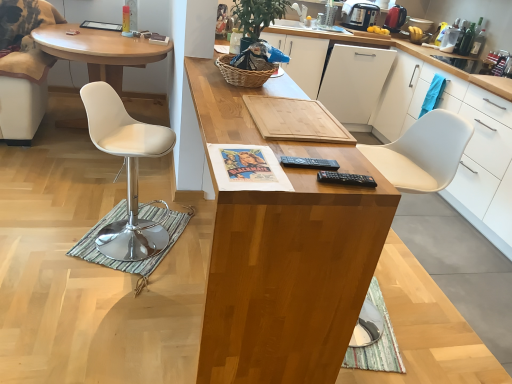
Question: Is white leather desk at left, arranged as the 1th desk when viewed from the back, smaller than white matte drawer at upper right?

Choices:
 (A) no
 (B) yes

Answer: (A)

Question: Does white leather desk at left, the 1th desk viewed from the left, have a greater height compared to white matte drawer at upper right?

Choices:
 (A) no
 (B) yes

Answer: (B)

Question: Is the depth of white leather desk at left, the 1th desk viewed from the left, greater than that of white matte drawer at upper right?

Choices:
 (A) no
 (B) yes

Answer: (A)

Question: Is white leather desk at left, the second desk from the right, at the right side of white matte drawer at upper right?

Choices:
 (A) no
 (B) yes

Answer: (A)

Question: From a real-world perspective, is white leather desk at left, the second desk from the right, under white matte drawer at upper right?

Choices:
 (A) no
 (B) yes

Answer: (B)

Question: Is white leather desk at left, the 1th desk viewed from the left, completely or partially outside of white matte drawer at upper right?

Choices:
 (A) yes
 (B) no

Answer: (A)

Question: Considering the relative sizes of black plastic remote control at right, which ranks as the 2th remote control in top-to-bottom order, and white matte cabinet at right, the 1th cabinetry viewed from the right, in the image provided, is black plastic remote control at right, which ranks as the 2th remote control in top-to-bottom order, bigger than white matte cabinet at right, the 1th cabinetry viewed from the right,?

Choices:
 (A) no
 (B) yes

Answer: (A)

Question: Considering the relative positions of black plastic remote control at right, marked as the first remote control in a bottom-to-top arrangement, and white matte cabinet at right, the 1th cabinetry viewed from the right, in the image provided, is black plastic remote control at right, marked as the first remote control in a bottom-to-top arrangement, behind white matte cabinet at right, the 1th cabinetry viewed from the right,?

Choices:
 (A) yes
 (B) no

Answer: (B)

Question: Is black plastic remote control at right, marked as the first remote control in a bottom-to-top arrangement, positioned far away from white matte cabinet at right, the 1th cabinetry viewed from the right?

Choices:
 (A) no
 (B) yes

Answer: (B)

Question: Considering the relative positions of black plastic remote control at right, marked as the first remote control in a bottom-to-top arrangement, and white matte cabinet at right, the 1th cabinetry viewed from the right, in the image provided, is black plastic remote control at right, marked as the first remote control in a bottom-to-top arrangement, to the right of white matte cabinet at right, the 1th cabinetry viewed from the right, from the viewer's perspective?

Choices:
 (A) no
 (B) yes

Answer: (A)

Question: Is black plastic remote control at right, marked as the first remote control in a bottom-to-top arrangement, oriented towards white matte cabinet at right, the 1th cabinetry viewed from the right?

Choices:
 (A) yes
 (B) no

Answer: (B)

Question: Is black plastic remote control at right, marked as the first remote control in a bottom-to-top arrangement, shorter than white matte cabinet at right, which is the 2th cabinetry in left-to-right order?

Choices:
 (A) no
 (B) yes

Answer: (B)

Question: Does white matte drawer at upper right come behind white leather desk at left, the second desk from the right?

Choices:
 (A) yes
 (B) no

Answer: (A)